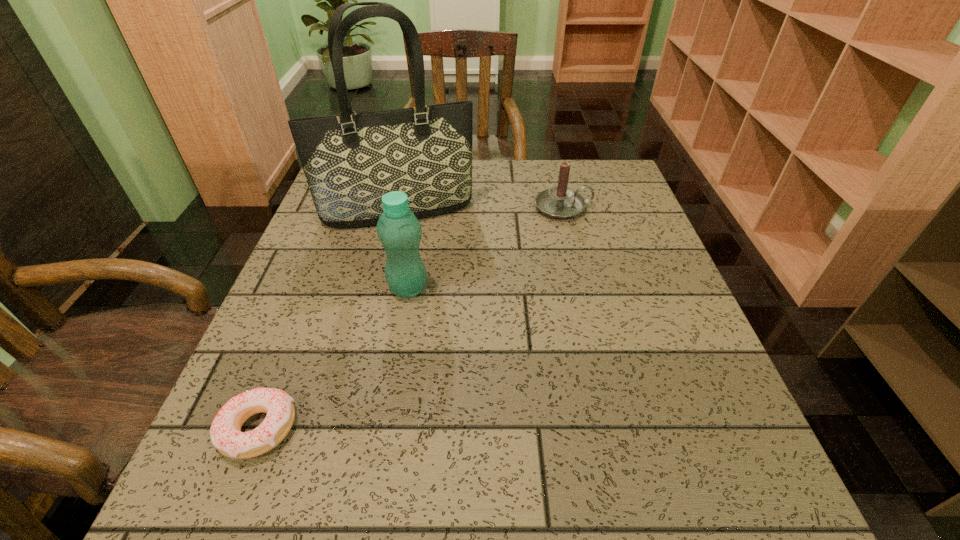
Find the location of a particular element. vacant region between the third farthest object and the doughnut is located at coordinates (333, 359).

The image size is (960, 540). I want to click on vacant area that lies between the shortest object and the water bottle, so click(x=333, y=359).

The height and width of the screenshot is (540, 960). In order to click on free spot between the rightmost object and the tallest object in this screenshot , I will do `click(481, 210)`.

The width and height of the screenshot is (960, 540). In order to click on object that stands as the closest to the nearest object in this screenshot , I will do `click(399, 231)`.

The image size is (960, 540). I want to click on the second closest object relative to the tallest object, so click(x=561, y=202).

Image resolution: width=960 pixels, height=540 pixels. Find the location of `vacant space that satisfies the following two spatial constraints: 1. on the side of the rightmost object with the handle loop; 2. on the front side of the tote bag`. vacant space that satisfies the following two spatial constraints: 1. on the side of the rightmost object with the handle loop; 2. on the front side of the tote bag is located at coordinates (564, 211).